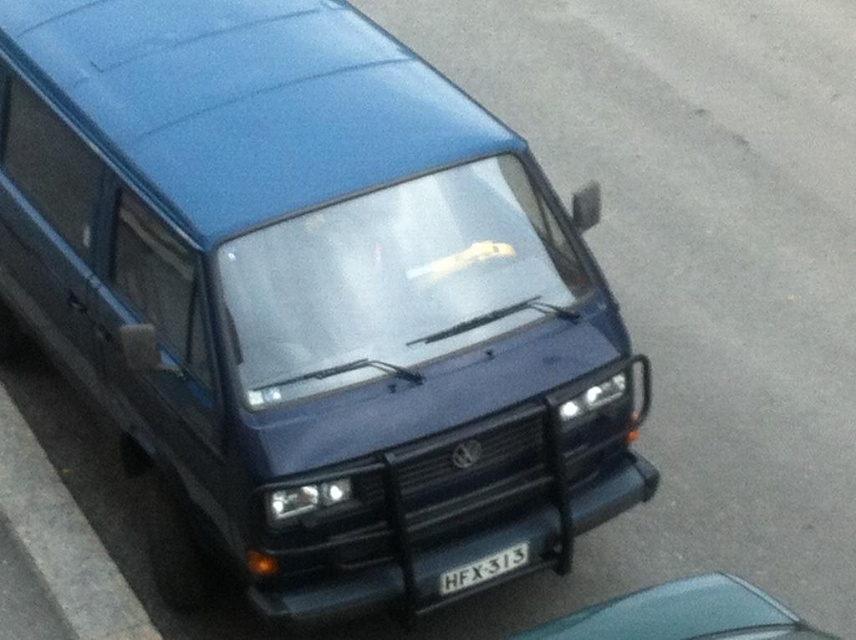
Which is in front, point (657, 106) or point (734, 600)?

Point (734, 600)

Is matte blue van at center further to camera compared to teal glossy car at lower right?

Yes, it is.

In order to click on matte blue van at center in this screenshot , I will do `click(696, 268)`.

Identify the location of matte blue van at center. (696, 268).

Is matte blue van at center further to camera compared to white plastic license plate at center?

Yes, matte blue van at center is further from the viewer.

Measure the distance between matte blue van at center and camera.

matte blue van at center and camera are 9.14 meters apart.

Locate an element on the screen. This screenshot has height=640, width=856. matte blue van at center is located at coordinates (696, 268).

Is point (716, 243) less distant than point (15, 440)?

That is False.

Does matte blue van at center have a smaller size compared to gray concrete curb at lower left?

Actually, matte blue van at center might be larger than gray concrete curb at lower left.

Where is `matte blue van at center`? The image size is (856, 640). matte blue van at center is located at coordinates (696, 268).

What are the coordinates of `matte blue van at center` in the screenshot? It's located at (696, 268).